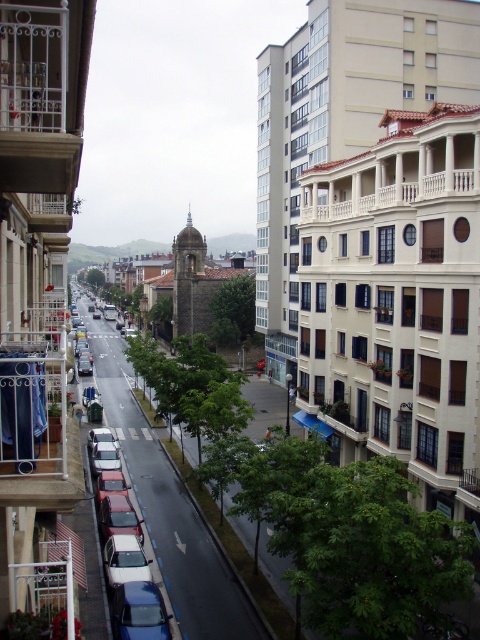
Which is behind, point (62, 412) or point (166, 611)?

The point (166, 611) is more distant.

Who is higher up, white metal balcony at left or metallic blue sedan at lower left?

white metal balcony at left

The image size is (480, 640). Find the location of `white metal balcony at left`. white metal balcony at left is located at coordinates (36, 262).

The image size is (480, 640). I want to click on white metal balcony at left, so click(x=36, y=262).

Does point (55, 506) come in front of point (187, 300)?

Yes, point (55, 506) is closer to viewer.

The height and width of the screenshot is (640, 480). What do you see at coordinates (36, 262) in the screenshot? I see `white metal balcony at left` at bounding box center [36, 262].

In order to click on white metal balcony at left in this screenshot , I will do `click(36, 262)`.

Does metallic blue sedan at lower left come in front of stone tower at center?

Yes, metallic blue sedan at lower left is in front of stone tower at center.

Find the location of a particular element. The height and width of the screenshot is (640, 480). metallic blue sedan at lower left is located at coordinates (139, 612).